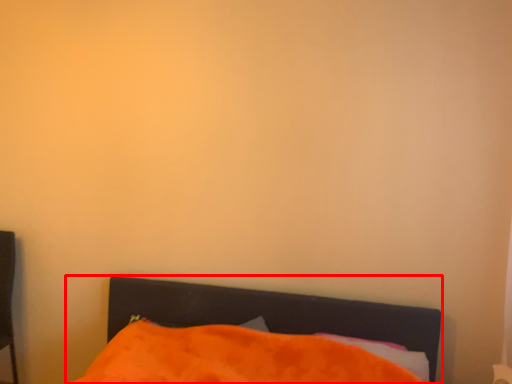
Question: From the image's perspective, where is bed (annotated by the red box) located relative to pillow?

Choices:
 (A) above
 (B) below

Answer: (B)